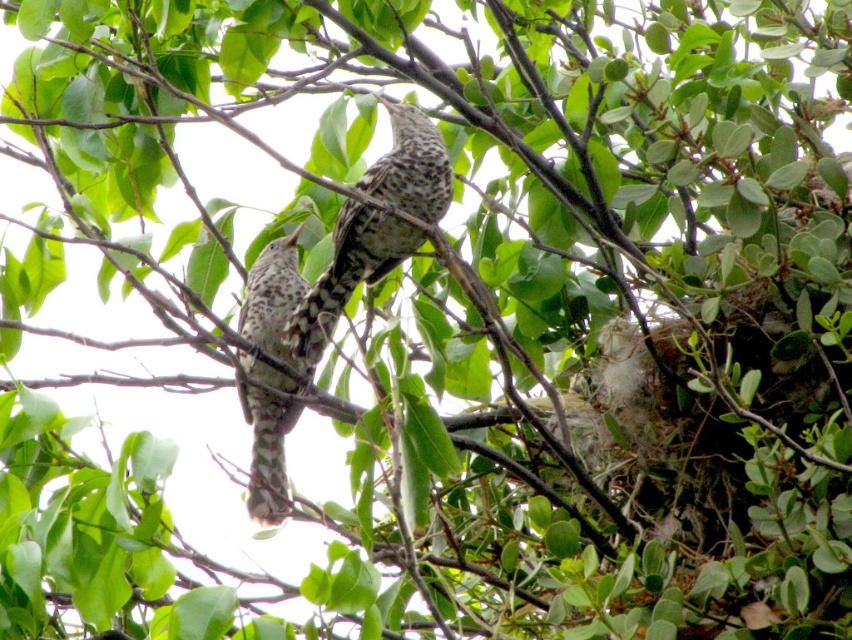
Question: Which point appears farthest from the camera in this image?

Choices:
 (A) (265, 257)
 (B) (381, 257)

Answer: (A)

Question: Is speckled feathered bird at center closer to camera compared to speckled feathered bird at left?

Choices:
 (A) yes
 (B) no

Answer: (A)

Question: Does speckled feathered bird at center have a lesser width compared to speckled feathered bird at left?

Choices:
 (A) yes
 (B) no

Answer: (B)

Question: Does speckled feathered bird at center have a lesser width compared to speckled feathered bird at left?

Choices:
 (A) yes
 (B) no

Answer: (B)